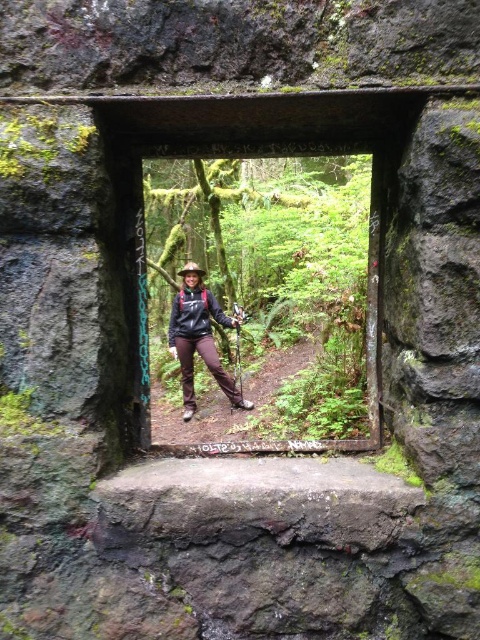
Question: Considering the relative positions of transparent glass window at center and matte black jacket at center in the image provided, where is transparent glass window at center located with respect to matte black jacket at center?

Choices:
 (A) right
 (B) left

Answer: (A)

Question: Which point is closer to the camera?

Choices:
 (A) coord(214,368)
 (B) coord(164,400)

Answer: (A)

Question: Which object is farther from the camera taking this photo?

Choices:
 (A) matte black jacket at center
 (B) transparent glass window at center

Answer: (A)

Question: Can you confirm if transparent glass window at center is positioned above matte black jacket at center?

Choices:
 (A) yes
 (B) no

Answer: (A)

Question: Is transparent glass window at center further to camera compared to matte black jacket at center?

Choices:
 (A) no
 (B) yes

Answer: (A)